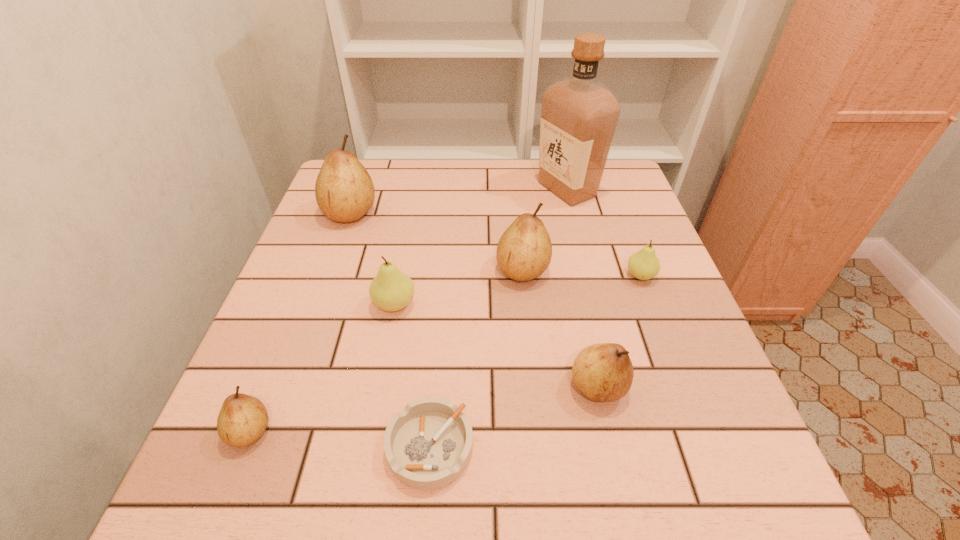
Where is `the third closest brown pear relative to the rightmost brown pear`? Image resolution: width=960 pixels, height=540 pixels. the third closest brown pear relative to the rightmost brown pear is located at coordinates (344, 191).

I want to click on vacant region that satisfies the following two spatial constraints: 1. on the back side of the right green pear; 2. on the left side of the shortest object, so click(x=444, y=276).